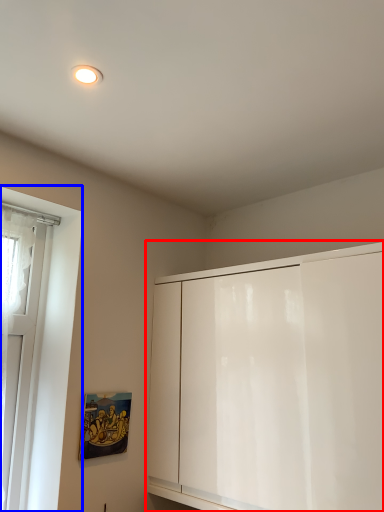
Question: Among these objects, which one is nearest to the camera, cabinetry (highlighted by a red box) or window (highlighted by a blue box)?

Choices:
 (A) cabinetry
 (B) window

Answer: (A)